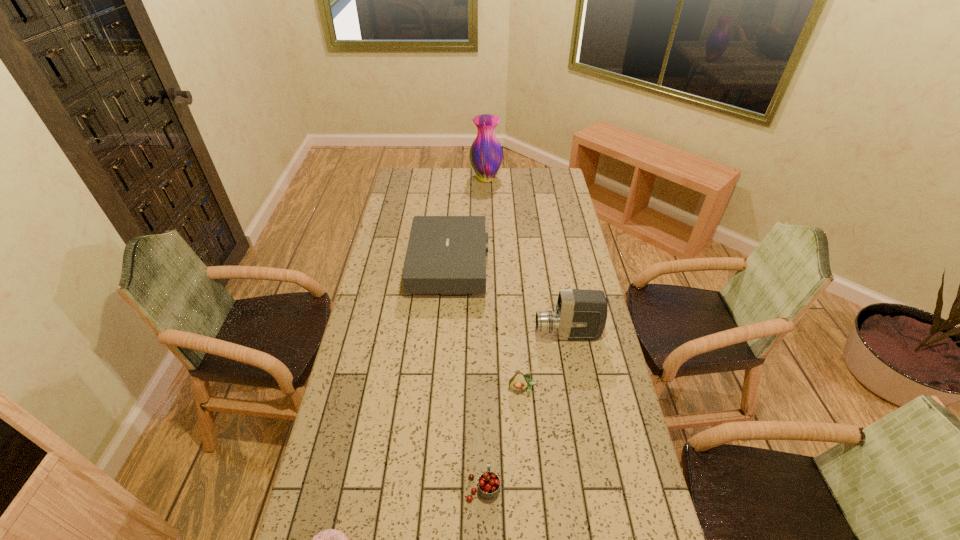
Locate an element on the screen. This screenshot has height=540, width=960. vase is located at coordinates (486, 154).

Where is `the farthest object`? This screenshot has height=540, width=960. the farthest object is located at coordinates (486, 154).

The width and height of the screenshot is (960, 540). What are the coordinates of `the second tallest object` in the screenshot? It's located at (580, 315).

The height and width of the screenshot is (540, 960). Find the location of `the fourth nearest object`. the fourth nearest object is located at coordinates (580, 315).

In order to click on projector in this screenshot , I will do `click(446, 254)`.

Image resolution: width=960 pixels, height=540 pixels. I want to click on the fifth nearest object, so click(446, 254).

This screenshot has height=540, width=960. In order to click on the fourth farthest object in this screenshot , I will do 520,381.

Find the location of a particular element. Image resolution: width=960 pixels, height=540 pixels. the second nearest object is located at coordinates (488, 483).

You are a GUI agent. You are given a task and a screenshot of the screen. Output one action in this format:
    pyautogui.click(x=<x>, y=<y>)
    Task: Click on the free point located on the left of the farthest object
    This screenshot has width=960, height=540.
    Given the screenshot: What is the action you would take?
    pyautogui.click(x=430, y=179)

At what (x,y) coordinates should I click in order to perform the action: click on free location located at the front of the camcorder, highlighting the lens. Please return your answer as a coordinate pair (x, y). Looking at the image, I should click on (496, 335).